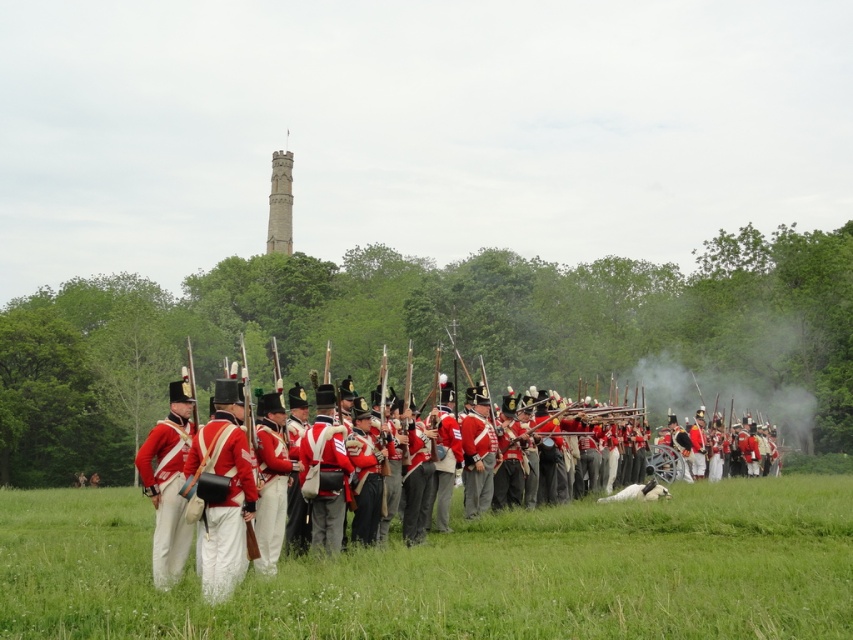
Does green grass at center have a greater height compared to red cotton uniform at center?

No, green grass at center is not taller than red cotton uniform at center.

Between point (639, 525) and point (187, 532), which one is positioned in front?

Positioned in front is point (187, 532).

Locate an element on the screen. The height and width of the screenshot is (640, 853). green grass at center is located at coordinates [x=461, y=572].

Between green grass at center and red wool uniform at left, which one appears on the right side from the viewer's perspective?

From the viewer's perspective, green grass at center appears more on the right side.

Locate an element on the screen. This screenshot has width=853, height=640. green grass at center is located at coordinates (461, 572).

Is red cotton uniform at center positioned at the back of red wool uniform at left?

That is False.

Does red cotton uniform at center have a lesser height compared to red wool uniform at left?

Incorrect, red cotton uniform at center's height does not fall short of red wool uniform at left's.

Locate an element on the screen. This screenshot has height=640, width=853. red cotton uniform at center is located at coordinates [225, 499].